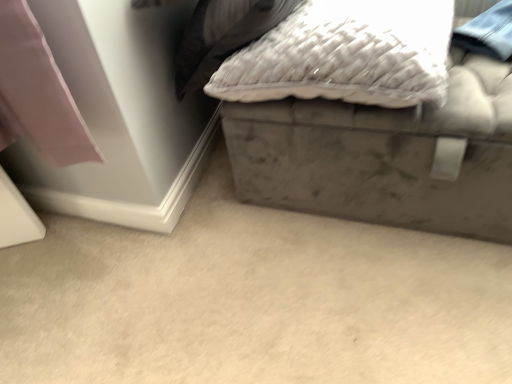
You are a GUI agent. You are given a task and a screenshot of the screen. Output one action in this format:
    pyautogui.click(x=<x>, y=<y>)
    Task: Click on the space that is in front of velvet gray ottoman at upper right
    The image size is (512, 384).
    Given the screenshot: What is the action you would take?
    pyautogui.click(x=377, y=301)